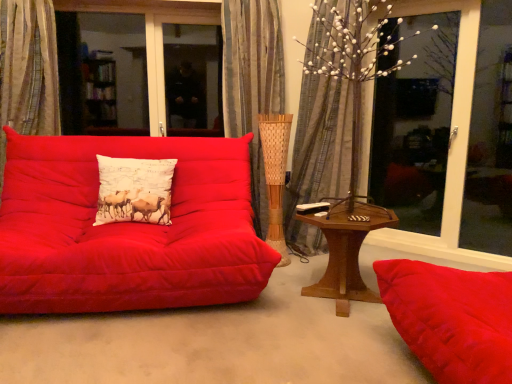
Question: Is point (338, 228) positioned closer to the camera than point (332, 122)?

Choices:
 (A) closer
 (B) farther

Answer: (A)

Question: Considering the positions of wooden hexagonal table at center and silky gray curtain at center, which is counted as the 1th curtain, starting from the right, in the image, is wooden hexagonal table at center bigger or smaller than silky gray curtain at center, which is counted as the 1th curtain, starting from the right,?

Choices:
 (A) small
 (B) big

Answer: (A)

Question: Estimate the real-world distances between objects in this image. Which object is closer to the silky gray curtain at center, which is counted as the 1th curtain, starting from the right?

Choices:
 (A) textured beige curtain at left, the third curtain when ordered from right to left
 (B) wooden hexagonal table at center
 (C) white printed cushion at center
 (D) matte red studio couch at left
 (E) transparent glass window at upper right

Answer: (B)

Question: Estimate the real-world distances between objects in this image. Which object is closer to the transparent glass window at upper right?

Choices:
 (A) silky gray curtain at center, the 3th curtain in the left-to-right sequence
 (B) white printed cushion at center
 (C) matte red studio couch at left
 (D) silky beige curtain at center, the second curtain when ordered from left to right
 (E) wooden hexagonal table at center

Answer: (A)